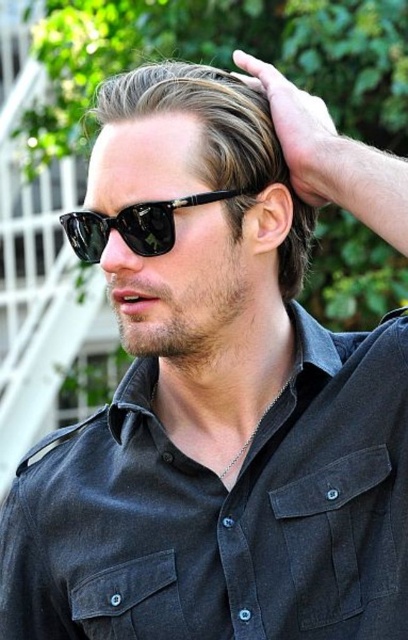
Based on the photo, you are a photographer adjusting your camera settings to focus on two points in the scene. The first point is at coordinates point [124,236] and the second is at point [99,253]. Which point should you focus on first if you want to ensure the closest object is in sharp focus?

Point [124,236] is closer to the camera than point [99,253], so you should focus on point [124,236] first to ensure the closest object is in sharp focus.

You are a photographer trying to capture the man in the image. You want to ensure that the black leather hand at upper center is centered in your photo. What coordinate should you aim for?

You should aim for the coordinate point at (x=301, y=134) to center the black leather hand at upper center in your photo.